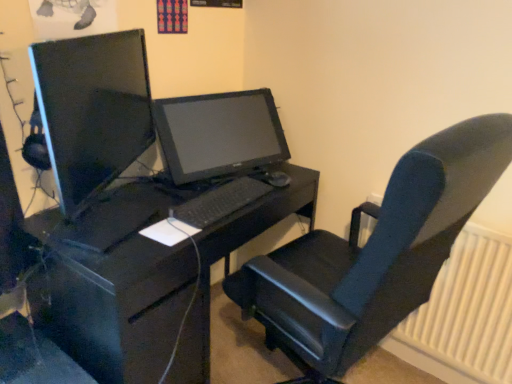
Where is `vacant area situated to the left side of black matte keyboard at center`? The width and height of the screenshot is (512, 384). vacant area situated to the left side of black matte keyboard at center is located at coordinates (151, 193).